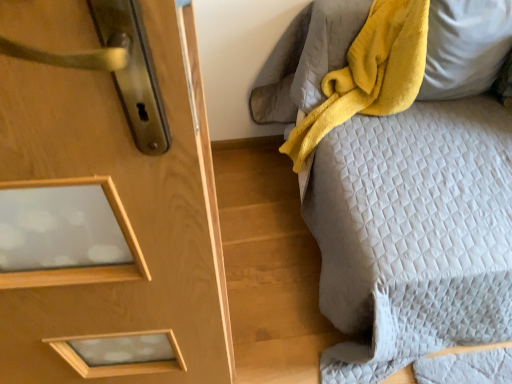
Question: From a real-world perspective, is yellow plush blanket at upper right located beneath quilted gray bedspread at right?

Choices:
 (A) yes
 (B) no

Answer: (B)

Question: Does yellow plush blanket at upper right lie in front of quilted gray bedspread at right?

Choices:
 (A) no
 (B) yes

Answer: (A)

Question: Is quilted gray bedspread at right inside yellow plush blanket at upper right?

Choices:
 (A) yes
 (B) no

Answer: (B)

Question: From the image's perspective, is yellow plush blanket at upper right under quilted gray bedspread at right?

Choices:
 (A) yes
 (B) no

Answer: (B)

Question: From the image's perspective, would you say yellow plush blanket at upper right is positioned over quilted gray bedspread at right?

Choices:
 (A) no
 (B) yes

Answer: (B)

Question: Is yellow plush blanket at upper right touching quilted gray bedspread at right?

Choices:
 (A) yes
 (B) no

Answer: (B)

Question: From a real-world perspective, is quilted gray bedspread at right beneath yellow soft pillow at upper right?

Choices:
 (A) no
 (B) yes

Answer: (B)

Question: From the image's perspective, is quilted gray bedspread at right above yellow soft pillow at upper right?

Choices:
 (A) no
 (B) yes

Answer: (A)

Question: Is quilted gray bedspread at right further to camera compared to yellow soft pillow at upper right?

Choices:
 (A) no
 (B) yes

Answer: (A)

Question: Is quilted gray bedspread at right completely or partially outside of yellow soft pillow at upper right?

Choices:
 (A) no
 (B) yes

Answer: (B)

Question: From the image's perspective, is quilted gray bedspread at right located beneath yellow soft pillow at upper right?

Choices:
 (A) no
 (B) yes

Answer: (B)

Question: Is quilted gray bedspread at right not near yellow soft pillow at upper right?

Choices:
 (A) no
 (B) yes

Answer: (A)

Question: Is yellow soft pillow at upper right looking in the opposite direction of yellow plush blanket at upper right?

Choices:
 (A) yes
 (B) no

Answer: (A)